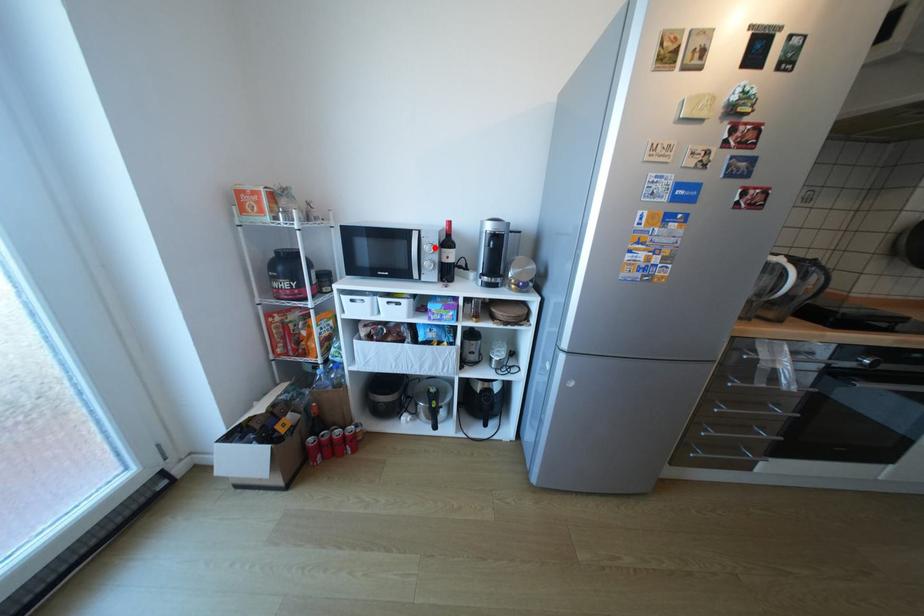
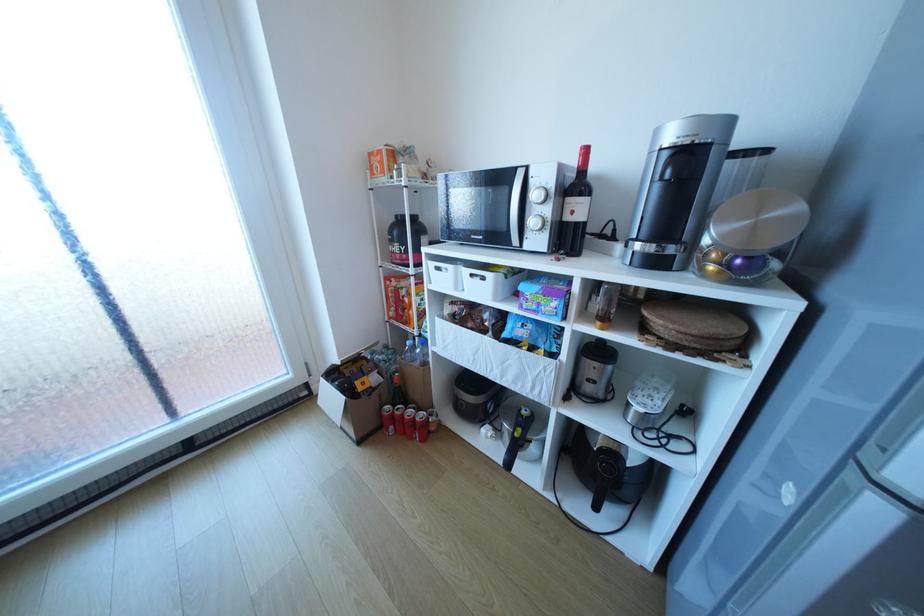
Locate, in the second image, the point that corresponds to the highlighted location in the first image.

(542, 195)